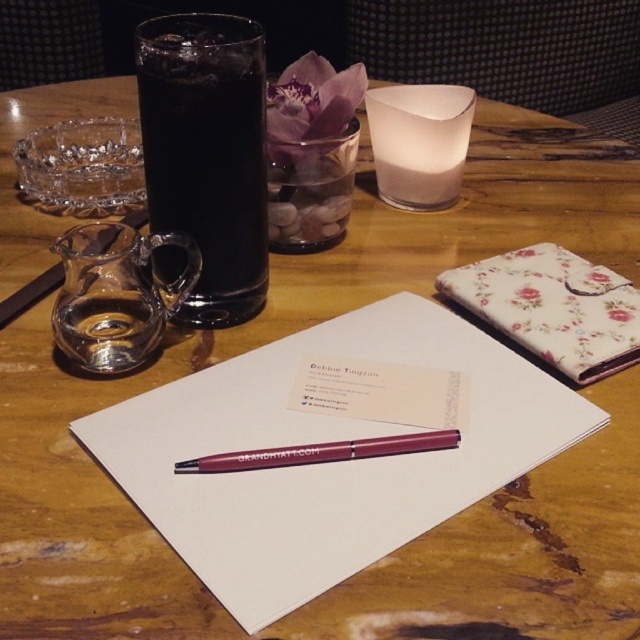
You are a server at a restaurant and need to place a new menu on the table. The menu is 12 inches tall. You see the black glass at upper left and the matte burgundy pen at center. Which object must you avoid placing the menu near to ensure it doesn not block the menu?

The black glass at upper left has a greater height compared to the matte burgundy pen at center. Therefore, you should avoid placing the menu near the black glass at upper left to prevent it from blocking the menu.

You are a waiter standing at the edge of the table. You need to place a new menu between the two points, point (x=237, y=134) and point (x=374, y=454). Since the menu is 10cm thick, will it block the view of the point that is further away?

Point (x=237, y=134) is further to the camera than point (x=374, y=454). Since the menu is placed between them, the point further away is point (x=374, y=454). The menu will block the view of point (x=374, y=454) because it is behind the menu.

You are a server at the restaurant and need to place a new menu on the table. The menu is 10 cm thick. There is a black glass at upper left and a white frosted glass candle at center. Which object should you move to make space, and why?

You should move the white frosted glass candle at center because the black glass at upper left is in front of it, so moving the candle would free up more space behind the black glass at upper left.